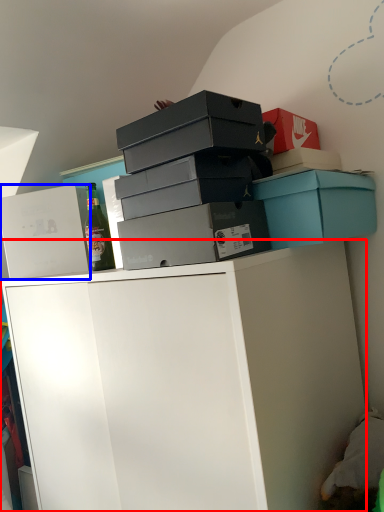
Question: Among these objects, which one is nearest to the camera, cabinetry (highlighted by a red box) or box (highlighted by a blue box)?

Choices:
 (A) cabinetry
 (B) box

Answer: (A)